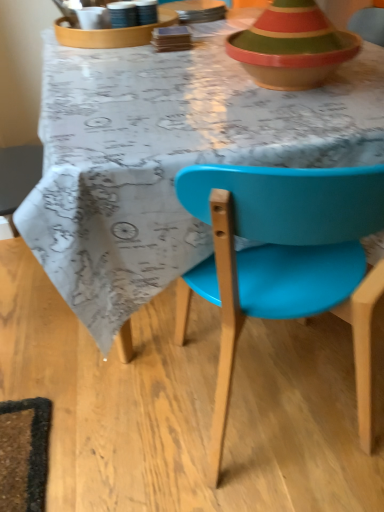
Question: Choose the correct answer: Is matte white tray at upper center, the first tableware from the left, inside matte plastic chair at center or outside it?

Choices:
 (A) outside
 (B) inside

Answer: (A)

Question: From a real-world perspective, relative to matte plastic chair at center, is matte white tray at upper center, the first tableware from the left, vertically above or below?

Choices:
 (A) below
 (B) above

Answer: (B)

Question: Which object is positioned farthest from the matte white tray at upper center, the first tableware from the left?

Choices:
 (A) matte plastic chair at center
 (B) matte ceramic cup at upper center, the 1th tableware positioned from the right
 (C) matte plastic chair at center

Answer: (A)

Question: Estimate the real-world distances between objects in this image. Which object is farther from the matte white tray at upper center, the first tableware from the left?

Choices:
 (A) matte plastic chair at center
 (B) matte plastic chair at center
 (C) matte ceramic cup at upper center, the 1th tableware positioned from the right

Answer: (A)